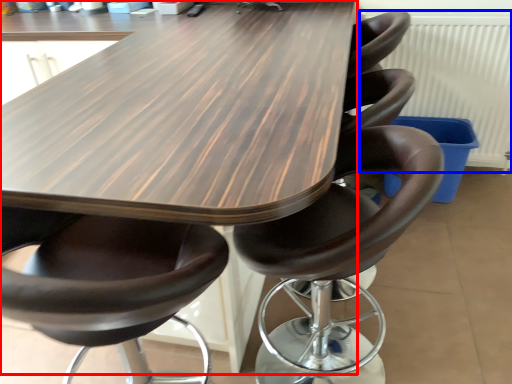
Question: Which object appears farthest to the camera in this image, table (highlighted by a red box) or radiator (highlighted by a blue box)?

Choices:
 (A) table
 (B) radiator

Answer: (B)